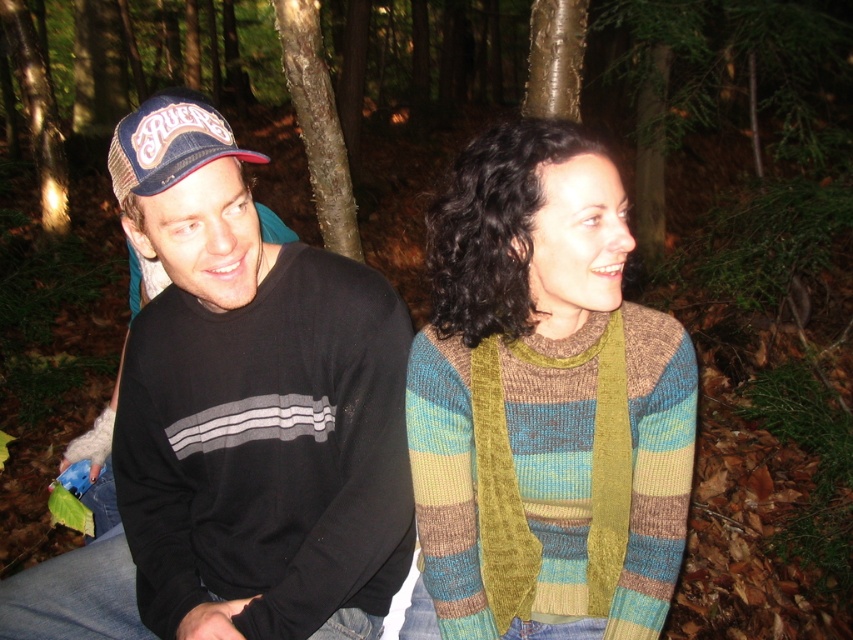
Who is more forward, (337, 579) or (175, 120)?

Point (175, 120)

Does black cotton sweatshirt at left have a larger size compared to blue mesh baseball cap at left?

Correct, black cotton sweatshirt at left is larger in size than blue mesh baseball cap at left.

Is point (283, 627) farther from camera compared to point (233, 141)?

Yes, it is behind point (233, 141).

What are the coordinates of `black cotton sweatshirt at left` in the screenshot? It's located at (236, 420).

Does knitted wool sweater at center appear on the left side of blue mesh baseball cap at left?

Incorrect, knitted wool sweater at center is not on the left side of blue mesh baseball cap at left.

Is point (502, 589) positioned behind point (202, 116)?

Yes.

This screenshot has width=853, height=640. Find the location of `knitted wool sweater at center`. knitted wool sweater at center is located at coordinates (544, 401).

Does black cotton sweatshirt at left have a smaller size compared to knitted wool sweater at center?

No.

Who is shorter, black cotton sweatshirt at left or knitted wool sweater at center?

knitted wool sweater at center

Locate an element on the screen. black cotton sweatshirt at left is located at coordinates (236, 420).